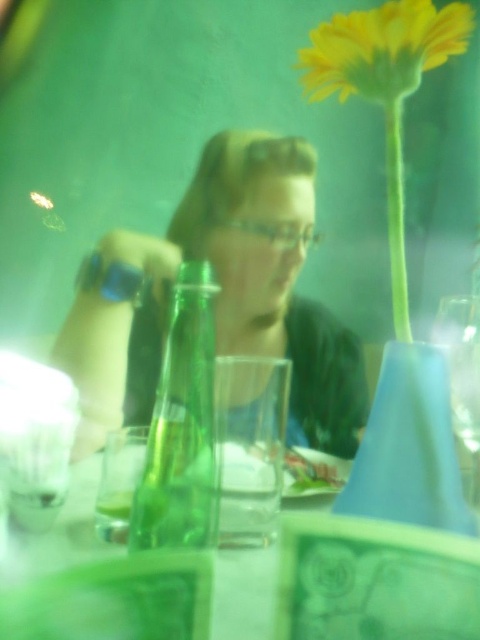
You are setting up a table for a small gathering. You have a green glass bottle at center and a transparent glass wine glass at right. Which object takes up more space on the table?

The transparent glass wine glass at right occupies more space than the green glass bottle at center, so it takes up more space on the table.

You are setting up a table for a dinner party and need to place a centerpiece. The yellow matte flower at upper right is currently above the transparent glass wine glass at right. Is there enough space to move the flower to the center of the table without knocking over the wine glass?

The yellow matte flower at upper right is positioned over transparent glass wine glass at right, so moving the flower to the center of the table would require clearing space. Since the flower is currently above the glass, there might be enough vertical space, but horizontal space depends on their placement. However, without knowing the exact dimensions, it is safer to assume there is enough space to move the flower to the center without knocking over the glass.